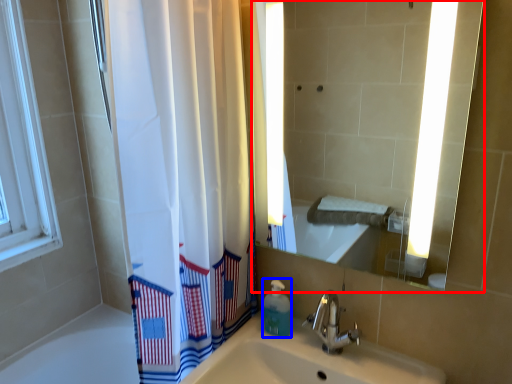
Question: Which of the following is the farthest to the observer, mirror (highlighted by a red box) or soap dispenser (highlighted by a blue box)?

Choices:
 (A) mirror
 (B) soap dispenser

Answer: (B)